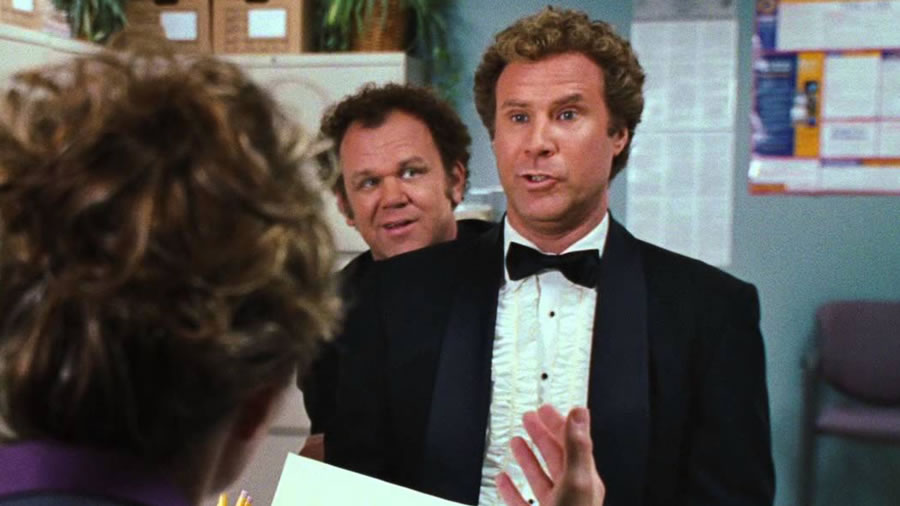
Identify the location of blue orange and white chart on the top right side of wall. (821, 98).